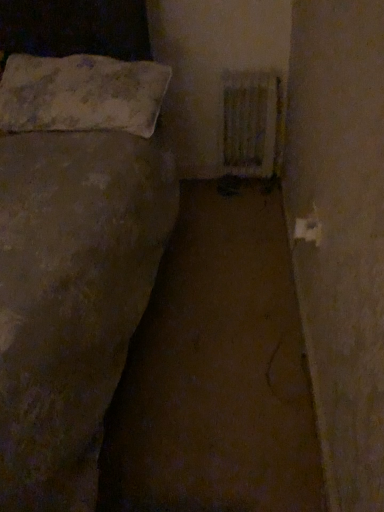
What do you see at coordinates (81, 94) in the screenshot? I see `white textured pillow at upper left` at bounding box center [81, 94].

The width and height of the screenshot is (384, 512). I want to click on white textured pillow at upper left, so click(x=81, y=94).

The image size is (384, 512). What do you see at coordinates (250, 122) in the screenshot? I see `white textured radiator at upper right` at bounding box center [250, 122].

Where is `white textured radiator at upper right`? This screenshot has height=512, width=384. white textured radiator at upper right is located at coordinates (250, 122).

Where is `white textured pillow at upper left`? white textured pillow at upper left is located at coordinates click(81, 94).

Which object is positioned more to the right, white textured pillow at upper left or white textured radiator at upper right?

white textured radiator at upper right.

In the scene shown: In the image, is white textured pillow at upper left positioned in front of or behind white textured radiator at upper right?

white textured pillow at upper left is positioned closer to the viewer than white textured radiator at upper right.

Is point (127, 109) positioned before point (252, 155)?

Yes, point (127, 109) is closer to viewer.

From the image's perspective, is white textured pillow at upper left positioned above or below white textured radiator at upper right?

From the image's perspective, white textured pillow at upper left appears above white textured radiator at upper right.

From a real-world perspective, who is located higher, white textured pillow at upper left or white textured radiator at upper right?

In real-world perspective, white textured pillow at upper left is above.

Can you confirm if white textured pillow at upper left is wider than white textured radiator at upper right?

Yes, white textured pillow at upper left is wider than white textured radiator at upper right.

Looking at this image, between white textured pillow at upper left and white textured radiator at upper right, which one has less height?

white textured pillow at upper left.

Is white textured pillow at upper left bigger than white textured radiator at upper right?

Yes.

Is white textured pillow at upper left inside or outside of white textured radiator at upper right?

The correct answer is: outside.

Looking at this image, is there a large distance between white textured pillow at upper left and white textured radiator at upper right?

No, there isn't a large distance between white textured pillow at upper left and white textured radiator at upper right.

Is white textured pillow at upper left facing away from white textured radiator at upper right?

That's not correct — white textured pillow at upper left is not looking away from white textured radiator at upper right.

Where is `radiator lying below the white textured pillow at upper left (from the image's perspective)`? radiator lying below the white textured pillow at upper left (from the image's perspective) is located at coordinates (250, 122).

Which object is positioned more to the left, white textured radiator at upper right or white textured pillow at upper left?

From the viewer's perspective, white textured pillow at upper left appears more on the left side.

Is white textured radiator at upper right positioned in front of white textured pillow at upper left?

No.

Considering the positions of point (273, 155) and point (160, 105), is point (273, 155) closer or farther from the camera than point (160, 105)?

Clearly, point (273, 155) is more distant from the camera than point (160, 105).

From the image's perspective, is white textured radiator at upper right on white textured pillow at upper left?

No, from the image's perspective, white textured radiator at upper right is not on top of white textured pillow at upper left.

From a real-world perspective, who is located higher, white textured radiator at upper right or white textured pillow at upper left?

From a 3D spatial view, white textured pillow at upper left is above.

Between white textured radiator at upper right and white textured pillow at upper left, which one has larger width?

white textured pillow at upper left.

Which of these two, white textured radiator at upper right or white textured pillow at upper left, stands taller?

Standing taller between the two is white textured radiator at upper right.

Does white textured radiator at upper right have a smaller size compared to white textured pillow at upper left?

Correct, white textured radiator at upper right occupies less space than white textured pillow at upper left.

Is white textured radiator at upper right situated inside white textured pillow at upper left or outside?

white textured radiator at upper right lies outside white textured pillow at upper left.

Is white textured radiator at upper right next to white textured pillow at upper left?

No, white textured radiator at upper right is not in contact with white textured pillow at upper left.

Is white textured radiator at upper right facing towards white textured pillow at upper left?

No, white textured radiator at upper right is not facing towards white textured pillow at upper left.

In order to click on radiator on the right of white textured pillow at upper left in this screenshot , I will do `click(250, 122)`.

The image size is (384, 512). I want to click on pillow above the white textured radiator at upper right (from the image's perspective), so click(x=81, y=94).

What are the coordinates of `radiator that appears behind the white textured pillow at upper left` in the screenshot? It's located at (250, 122).